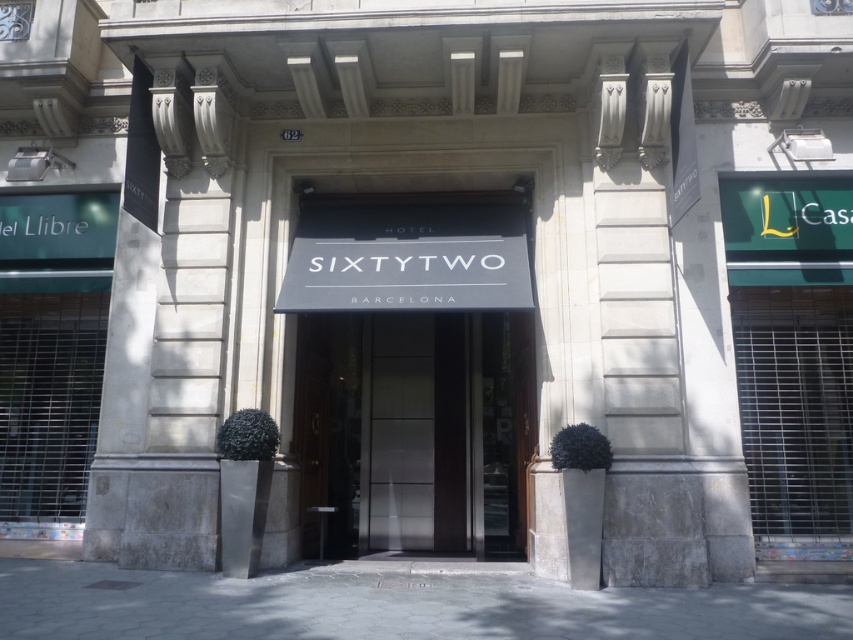
What is the spatial relationship between the satin black door at center and the black matte sign at center in the entrance of Sixtytwo Hotel Barcelona?

The satin black door at center is located to the right of the black matte sign at center.

You are standing at the entrance of Sixtytwo Hotel Barcelona. You see two points marked on the awning. The first point is at coordinates point (527, 396) and the second is at point (502, 236). Which point is closer to you?

Point (502, 236) is closer to you because it is in front of point (527, 396).